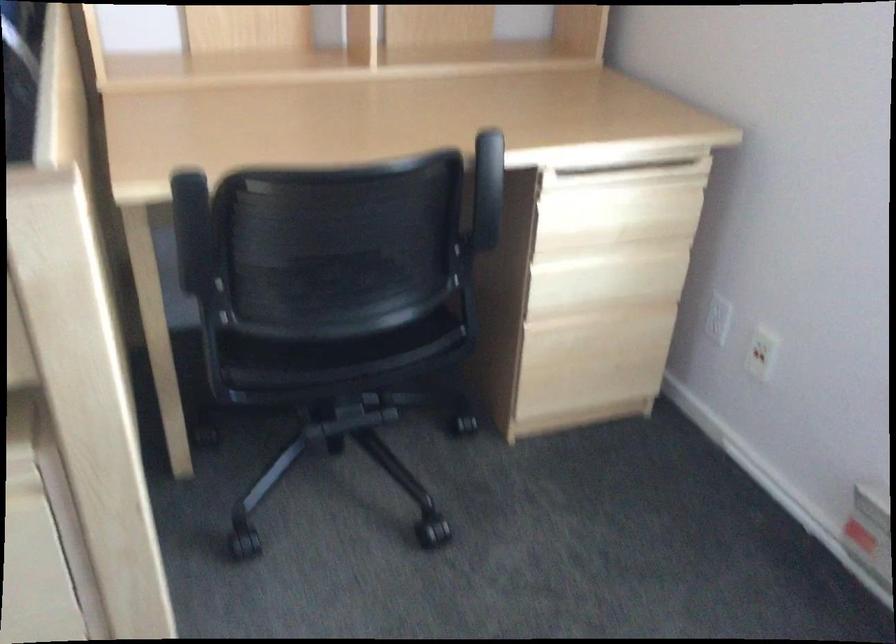
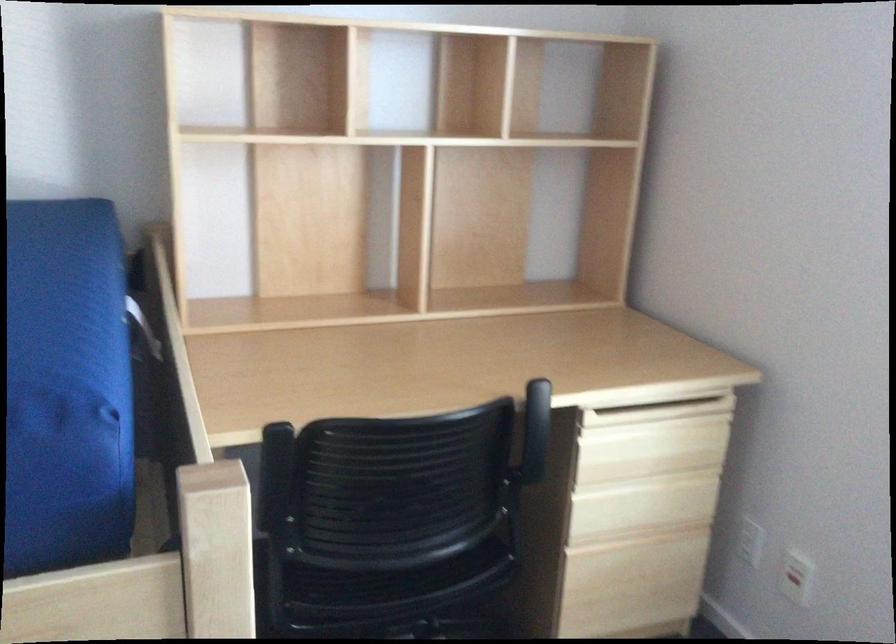
Locate, in the second image, the point that corresponds to point (716, 315) in the first image.

(750, 541)